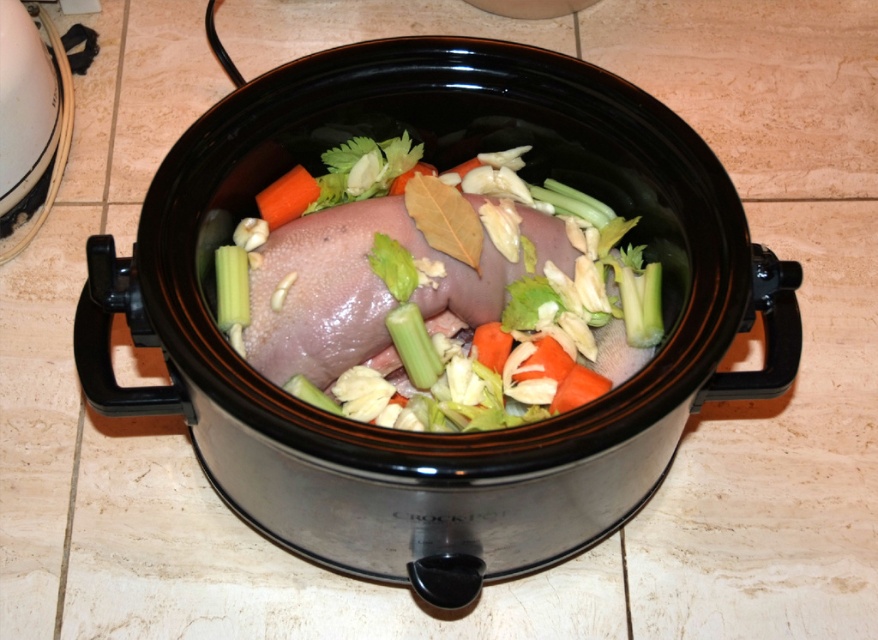
Question: Is pink raw meat at center thinner than orange smooth carrot at center?

Choices:
 (A) yes
 (B) no

Answer: (B)

Question: Is pink raw meat at center to the left of orange smooth carrot at center from the viewer's perspective?

Choices:
 (A) yes
 (B) no

Answer: (B)

Question: Which of the following is the closest to the observer?

Choices:
 (A) (277, 212)
 (B) (414, 211)

Answer: (B)

Question: Which point is closer to the camera taking this photo?

Choices:
 (A) (519, 349)
 (B) (299, 214)

Answer: (A)

Question: Does pink raw meat at center have a larger size compared to orange smooth carrot at center?

Choices:
 (A) yes
 (B) no

Answer: (A)